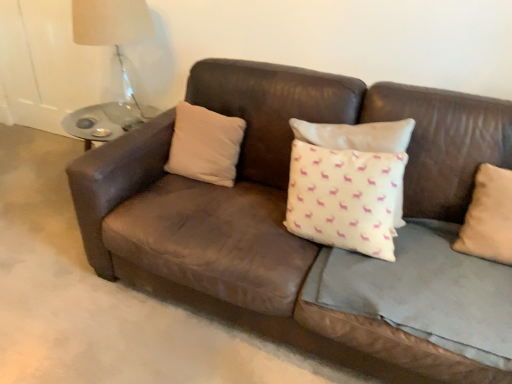
Question: From a real-world perspective, relative to translucent glass table lamp at upper left, is beige fabric pillow at right, the first pillow from the front, vertically above or below?

Choices:
 (A) above
 (B) below

Answer: (B)

Question: From their relative heights in the image, would you say beige fabric pillow at right, the 1th pillow viewed from the right, is taller or shorter than translucent glass table lamp at upper left?

Choices:
 (A) tall
 (B) short

Answer: (B)

Question: Estimate the real-world distances between objects in this image. Which object is farther from the white matte pillow at center, which is counted as the 1th pillow, starting from the back?

Choices:
 (A) beige fabric pillow at right, the second pillow in the left-to-right sequence
 (B) brown leather couch at center
 (C) translucent glass table lamp at upper left

Answer: (A)

Question: Which of these objects is positioned closest to the translucent glass table lamp at upper left?

Choices:
 (A) brown leather couch at center
 (B) white matte pillow at center, the 1th pillow in the left-to-right sequence
 (C) beige fabric pillow at right, the 1th pillow viewed from the right

Answer: (B)